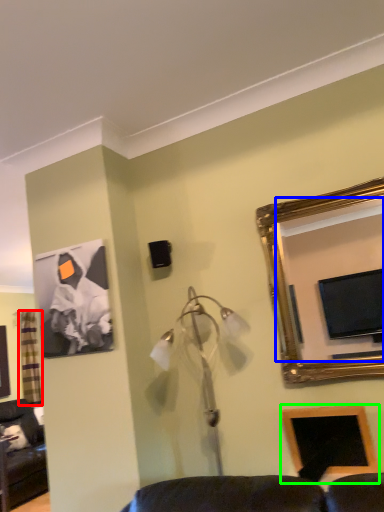
Question: Which object is the farthest from curtain (highlighted by a red box)? Choose among these: mirror (highlighted by a blue box) or picture frame (highlighted by a green box).

Choices:
 (A) mirror
 (B) picture frame

Answer: (A)